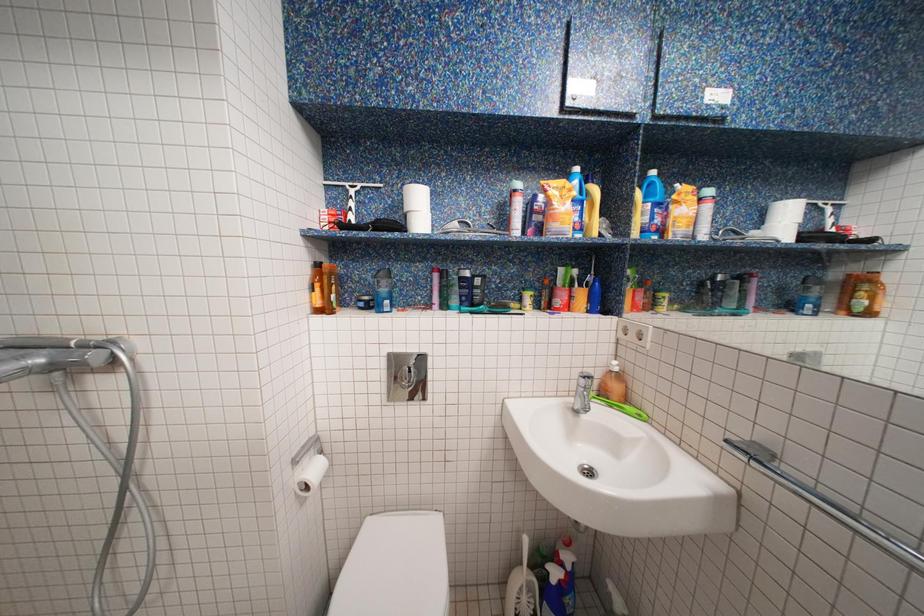
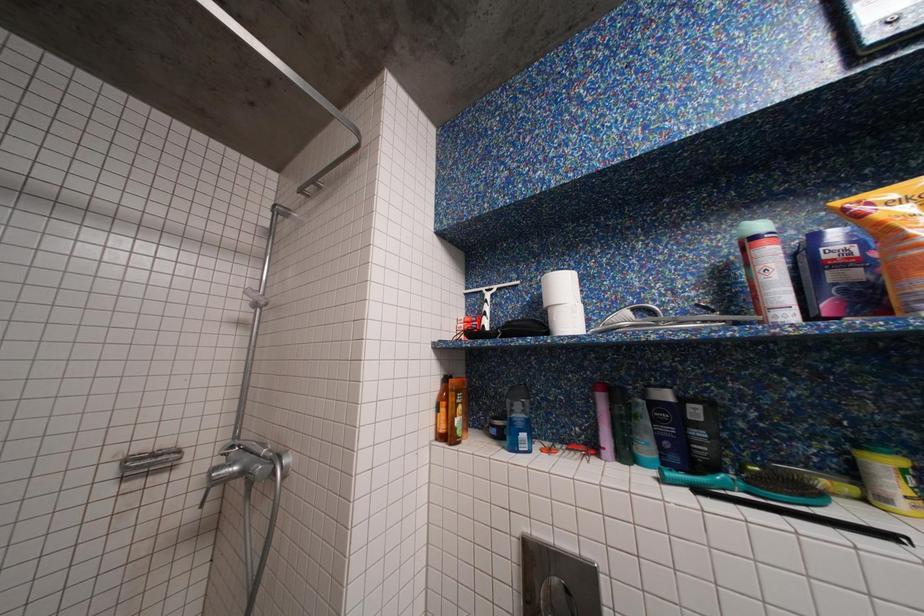
The first image is from the beginning of the video and the second image is from the end. How did the camera likely rotate when shooting the video?

The rotation direction of the camera is left-up.